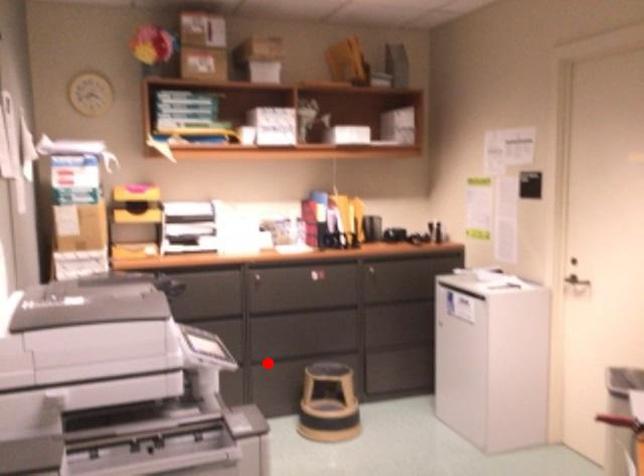
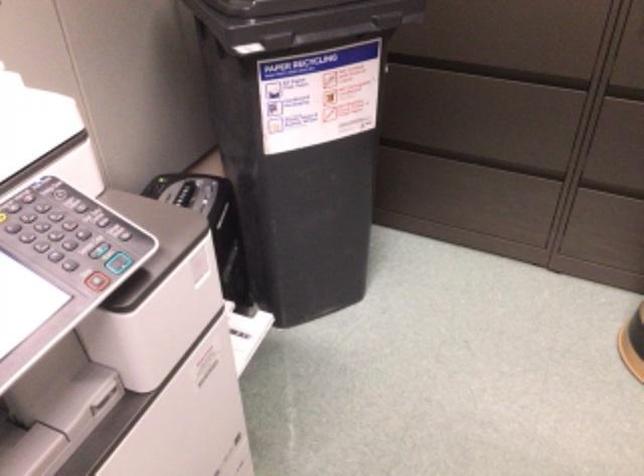
Question: A red point is marked in image1. In image2, is the corresponding 3D point closer to the camera or farther? Reply with the corresponding letter.

Choices:
 (A) The corresponding 3D point is closer.
 (B) The corresponding 3D point is farther.

Answer: (A)